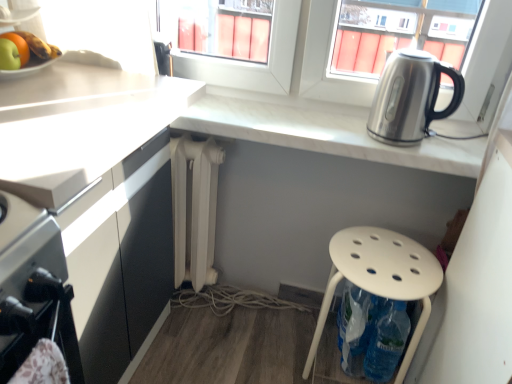
Identify the location of vacant area on top of white matte countertop at left, which is the 1th countertop in left-to-right order (from a real-world perspective). Image resolution: width=512 pixels, height=384 pixels. (67, 98).